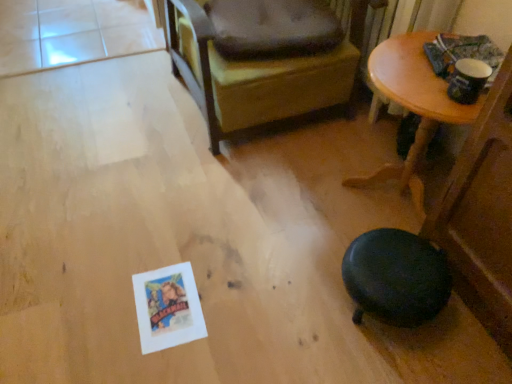
What are the coordinates of `free spot above wooden table at upper right (from a real-world perspective)` in the screenshot? It's located at (421, 74).